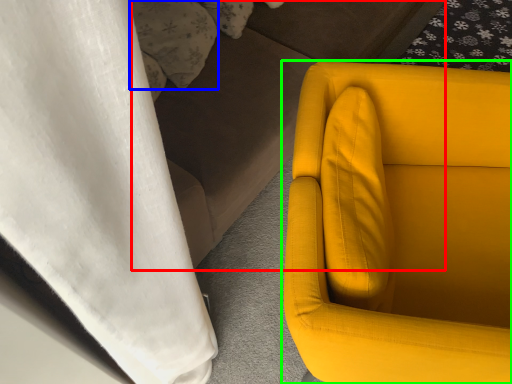
Question: Which object is positioned closest to couch (highlighted by a red box)? Select from pillow (highlighted by a blue box) and chair (highlighted by a green box).

Choices:
 (A) pillow
 (B) chair

Answer: (A)